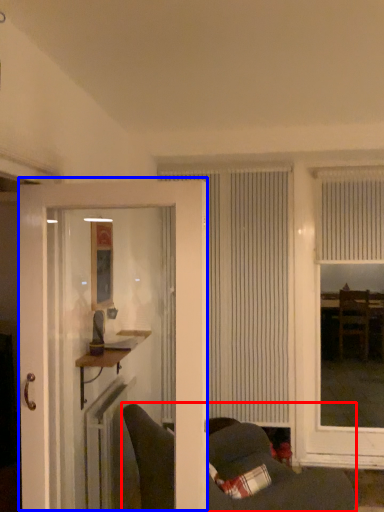
Question: Among these objects, which one is farthest to the camera, furniture (highlighted by a red box) or door (highlighted by a blue box)?

Choices:
 (A) furniture
 (B) door

Answer: (A)